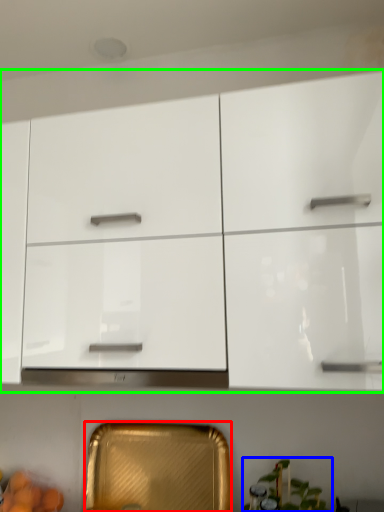
Question: Estimate the real-world distances between objects in this image. Which object is farther from cabinetry (highlighted by a red box), plant (highlighted by a blue box) or cabinetry (highlighted by a green box)?

Choices:
 (A) plant
 (B) cabinetry

Answer: (B)